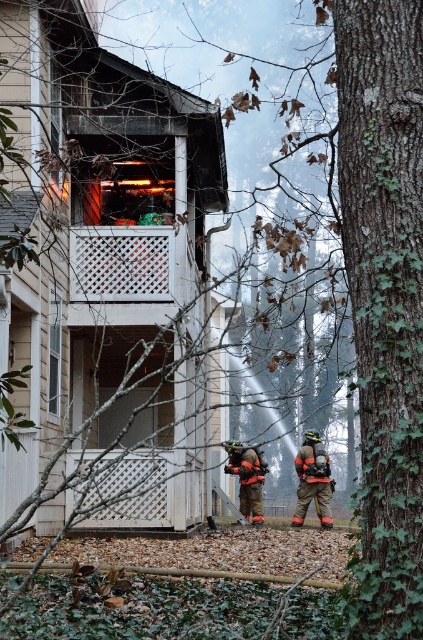
Is orange reflective suit at lower right above orange reflective gear at lower center?

No, orange reflective suit at lower right is not above orange reflective gear at lower center.

Describe the element at coordinates (313, 481) in the screenshot. I see `orange reflective suit at lower right` at that location.

Find the location of a particular element. This screenshot has height=640, width=423. orange reflective suit at lower right is located at coordinates (313, 481).